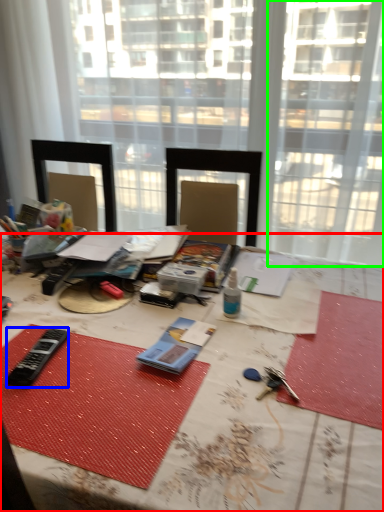
Question: Which is farther away from table (highlighted by a red box)? equipment (highlighted by a blue box) or window (highlighted by a green box)?

Choices:
 (A) equipment
 (B) window

Answer: (B)